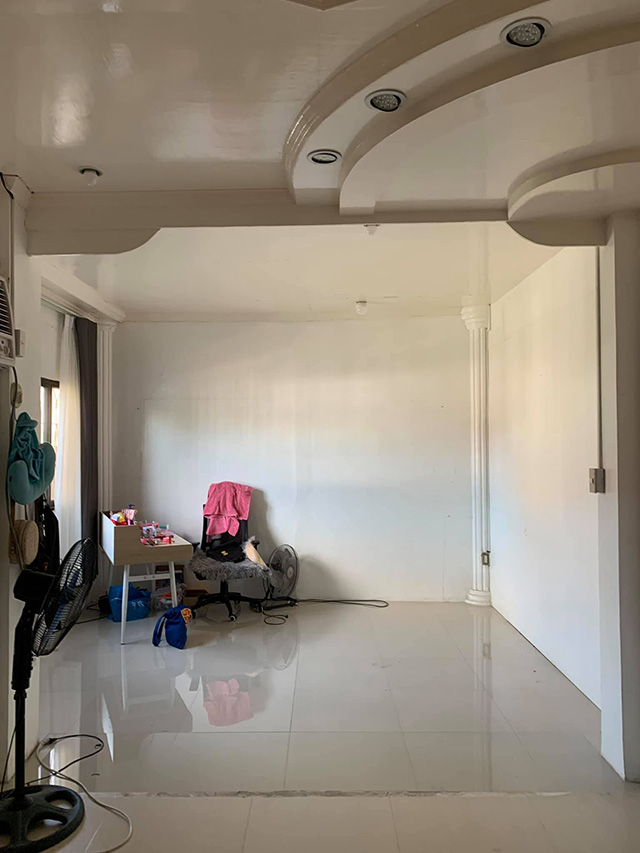
You are a GUI agent. You are given a task and a screenshot of the screen. Output one action in this format:
    pyautogui.click(x=<x>, y=<y>)
    Task: Click on the armrests
    
    Given the screenshot: What is the action you would take?
    pyautogui.click(x=194, y=543), pyautogui.click(x=256, y=543)